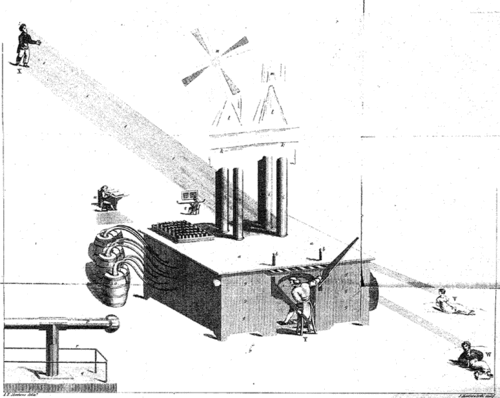
Where is `cable`? cable is located at coordinates (133, 229), (135, 233), (140, 239), (141, 246), (142, 250), (143, 258), (141, 263), (141, 268), (140, 276).